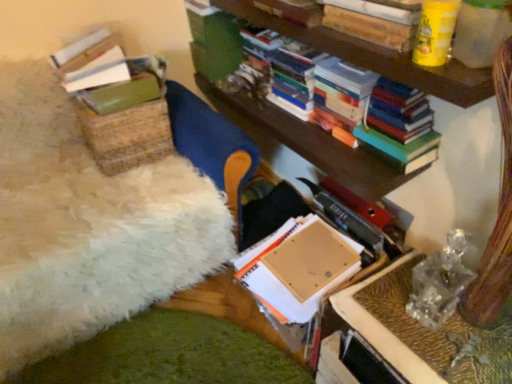
Question: From the image's perspective, is cardboard box at center, arranged as the second book when viewed from the top, above or below translucent plastic table at lower right?

Choices:
 (A) above
 (B) below

Answer: (A)

Question: Considering the positions of cardboard box at center, arranged as the second book when viewed from the top, and translucent plastic table at lower right in the image, is cardboard box at center, arranged as the second book when viewed from the top, bigger or smaller than translucent plastic table at lower right?

Choices:
 (A) big
 (B) small

Answer: (A)

Question: Based on their relative distances, which object is farther from the translucent plastic table at lower right?

Choices:
 (A) hardcover book at upper center, positioned as the 2th book in bottom-to-top order
 (B) hardcover books at upper right
 (C) cardboard box at center, arranged as the second book when viewed from the top

Answer: (A)

Question: Estimate the real-world distances between objects in this image. Which object is closer to the cardboard box at center, the 1th book from the bottom?

Choices:
 (A) hardcover books at upper right
 (B) translucent plastic table at lower right
 (C) hardcover book at upper center, positioned as the 2th book in bottom-to-top order

Answer: (B)